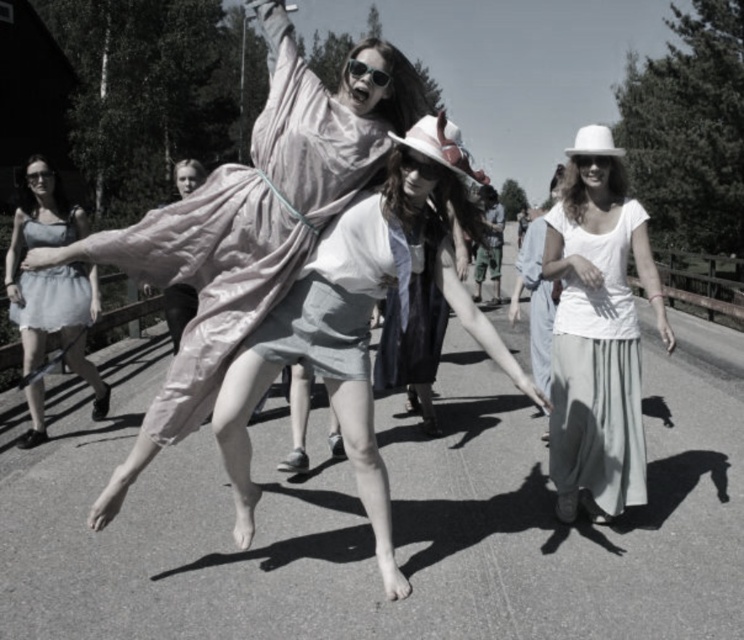
Question: Considering the relative positions of white cotton hat at upper right and transparent plastic goggles at center in the image provided, where is white cotton hat at upper right located with respect to transparent plastic goggles at center?

Choices:
 (A) below
 (B) above

Answer: (A)

Question: Which point is farther from the camera taking this photo?

Choices:
 (A) (426, 160)
 (B) (571, 465)

Answer: (B)

Question: Which of the following is the farthest from the observer?

Choices:
 (A) matte gray dress at left
 (B) transparent plastic goggles at center

Answer: (A)

Question: Is light gray denim shorts at center further to the viewer compared to matte white dress at center?

Choices:
 (A) no
 (B) yes

Answer: (A)

Question: Can you confirm if matte black goggles at center is smaller than matte black goggles at upper left?

Choices:
 (A) yes
 (B) no

Answer: (A)

Question: Estimate the real-world distances between objects in this image. Which object is farther from the transparent plastic goggles at center?

Choices:
 (A) matte gray dress at left
 (B) matte black goggles at upper left
 (C) light blue denim dress at left

Answer: (B)